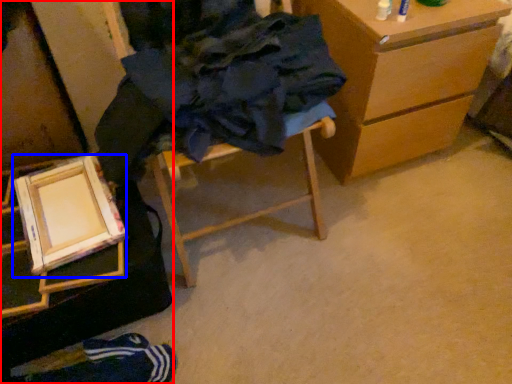
Question: Which point is closer to the camera, furniture (highlighted by a red box) or picture frame (highlighted by a blue box)?

Choices:
 (A) furniture
 (B) picture frame

Answer: (A)